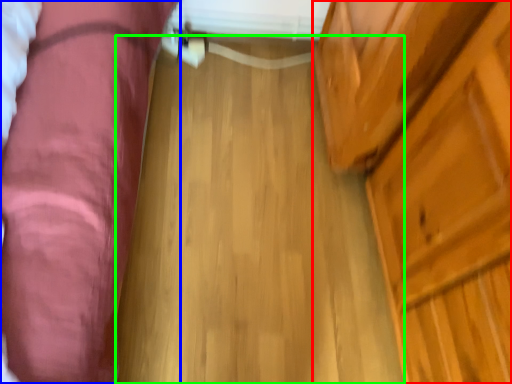
Question: Which object is the farthest from dresser (highlighted by a red box)? Choose among these: furniture (highlighted by a blue box) or plank (highlighted by a green box).

Choices:
 (A) furniture
 (B) plank

Answer: (A)